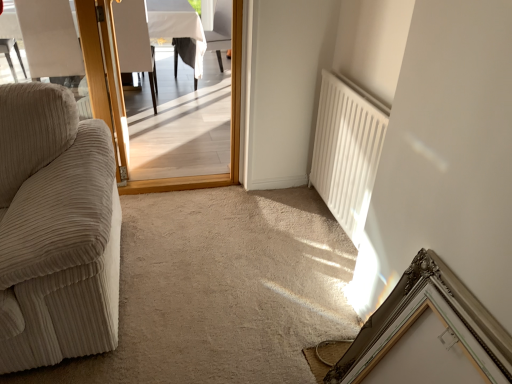
Question: Relative to wooden screen door at left, is white fabric chair at upper center in front or behind?

Choices:
 (A) front
 (B) behind

Answer: (B)

Question: Is white fabric chair at upper center spatially inside wooden screen door at left, or outside of it?

Choices:
 (A) inside
 (B) outside

Answer: (B)

Question: Which object is the closest to the wooden door at center?

Choices:
 (A) beige corduroy armchair at left, marked as the first armchair in a right-to-left arrangement
 (B) white matte radiator at right
 (C) beige corduroy armchair at left, positioned as the 1th armchair in left-to-right order
 (D) white fabric chair at upper center
 (E) silver ornate picture frame at lower right

Answer: (A)

Question: Which of these objects is positioned farthest from the beige corduroy armchair at left, positioned as the 1th armchair in left-to-right order?

Choices:
 (A) wooden door at center
 (B) silver ornate picture frame at lower right
 (C) white matte radiator at right
 (D) white fabric chair at upper center
 (E) wooden screen door at left

Answer: (B)